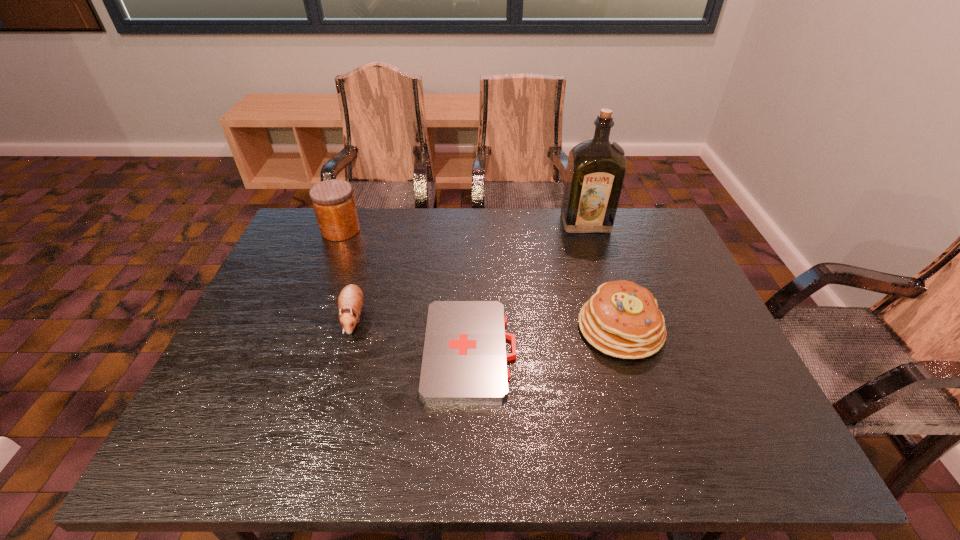
The width and height of the screenshot is (960, 540). In order to click on vacant space located on the front of the pancake in this screenshot , I will do `click(638, 384)`.

You are a GUI agent. You are given a task and a screenshot of the screen. Output one action in this format:
    pyautogui.click(x=<x>, y=<y>)
    Task: Click on the vacant space located 0.130m at the face of the second object from left to right
    The image size is (960, 540).
    Given the screenshot: What is the action you would take?
    pyautogui.click(x=333, y=388)

At what (x,y) coordinates should I click in order to perform the action: click on vacant region located 0.290m on handle side the third object from left to right. Please return your answer as a coordinate pair (x, y). The height and width of the screenshot is (540, 960). Looking at the image, I should click on (636, 349).

I want to click on liquor at the far edge, so click(596, 168).

You are a GUI agent. You are given a task and a screenshot of the screen. Output one action in this format:
    pyautogui.click(x=<x>, y=<y>)
    Task: Click on the jar located at the far edge
    
    Given the screenshot: What is the action you would take?
    pyautogui.click(x=333, y=201)

At what (x,y) coordinates should I click in order to perform the action: click on object present at the left edge. Please return your answer as a coordinate pair (x, y). Looking at the image, I should click on (333, 201).

You are a GUI agent. You are given a task and a screenshot of the screen. Output one action in this format:
    pyautogui.click(x=<x>, y=<y>)
    Task: Click on the object at the right edge
    The height and width of the screenshot is (540, 960).
    Given the screenshot: What is the action you would take?
    pyautogui.click(x=622, y=319)

You are a GUI agent. You are given a task and a screenshot of the screen. Output one action in this format:
    pyautogui.click(x=<x>, y=<y>)
    Task: Click on the object situated at the far left corner
    The width and height of the screenshot is (960, 540).
    Given the screenshot: What is the action you would take?
    pyautogui.click(x=333, y=201)

This screenshot has width=960, height=540. Find the location of `blank space at the far edge`. blank space at the far edge is located at coordinates (394, 208).

You are a GUI agent. You are given a task and a screenshot of the screen. Output one action in this format:
    pyautogui.click(x=<x>, y=<y>)
    Task: Click on the vacant space at the near edge of the desktop
    The image size is (960, 540).
    Given the screenshot: What is the action you would take?
    pyautogui.click(x=483, y=443)